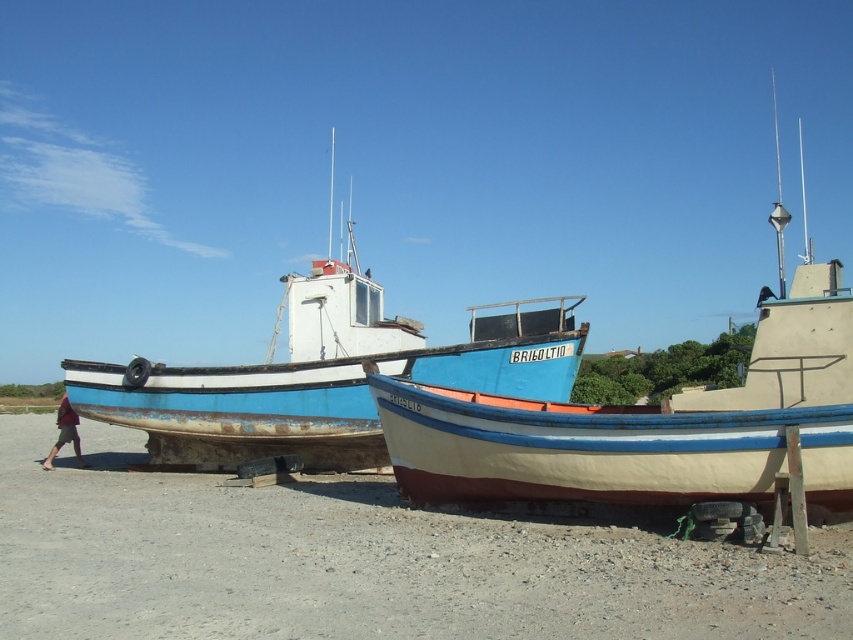
You are standing at the point marked as point (654, 422). Looking towards the blue painted wood boat at center, which direction should you walk to reach it?

The blue painted wood boat at center is located at point (654, 422), so you are already at the same location as the boat. You don

You are standing on the sandy beach looking at the two boats. There are two points marked on the image. Which point, point (399,438) or point (123,381), is closer to you?

Point (399,438) is closer to the viewer than point (123,381).